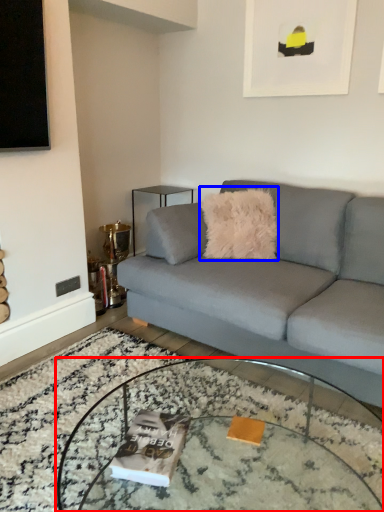
Question: Which object appears closest to the camera in this image, coffee table (highlighted by a red box) or throw pillow (highlighted by a blue box)?

Choices:
 (A) coffee table
 (B) throw pillow

Answer: (A)